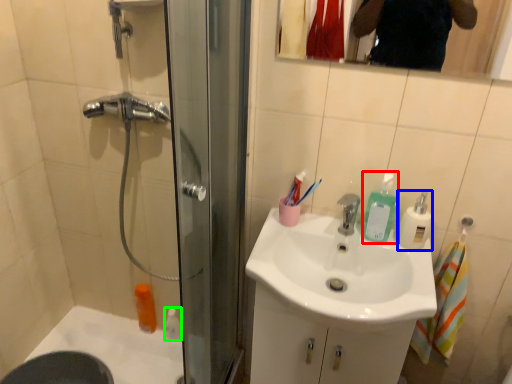
Question: Which is nearer to the soap dispenser (highlighted by a red box)? soap dispenser (highlighted by a blue box) or toiletry (highlighted by a green box).

Choices:
 (A) soap dispenser
 (B) toiletry

Answer: (A)